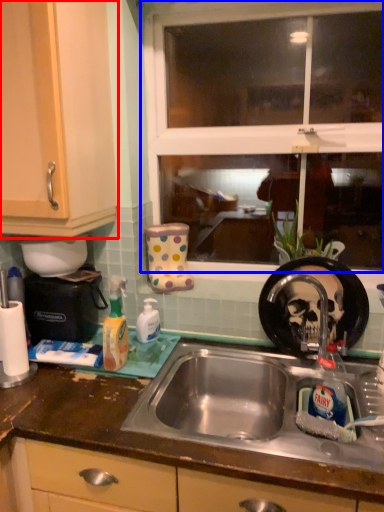
Question: Which point is closer to the camera, cabinetry (highlighted by a red box) or window (highlighted by a blue box)?

Choices:
 (A) cabinetry
 (B) window

Answer: (A)